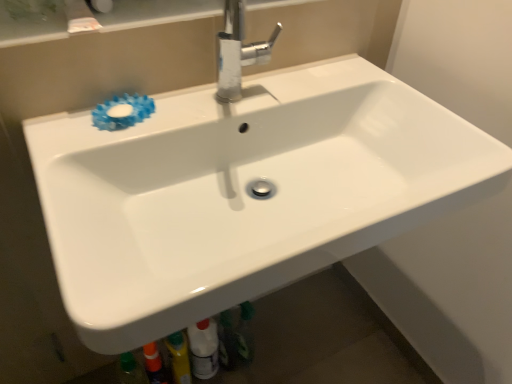
This screenshot has height=384, width=512. Identify the location of vacant area that lies between blue rubber flower at upper left and polished chrome faucet at upper center. (191, 111).